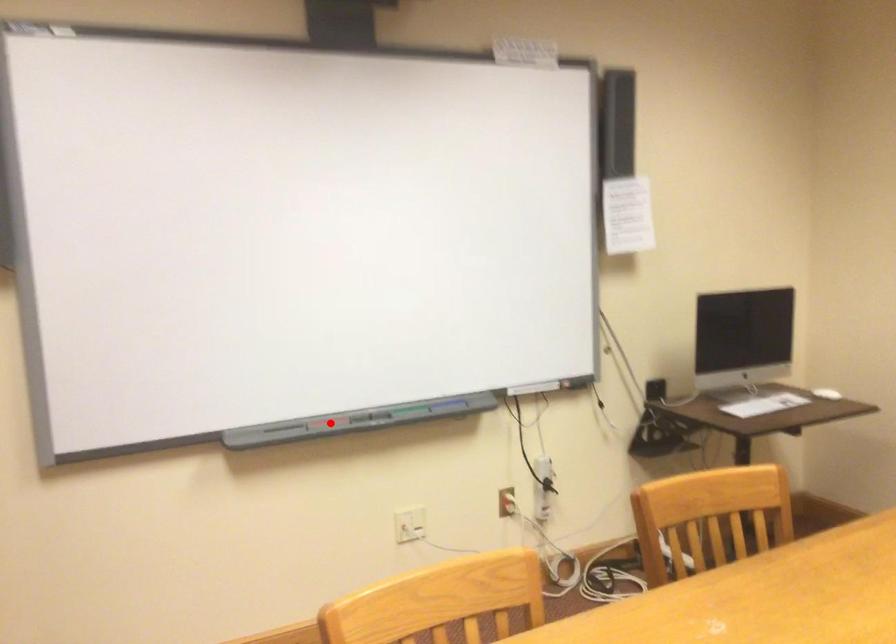
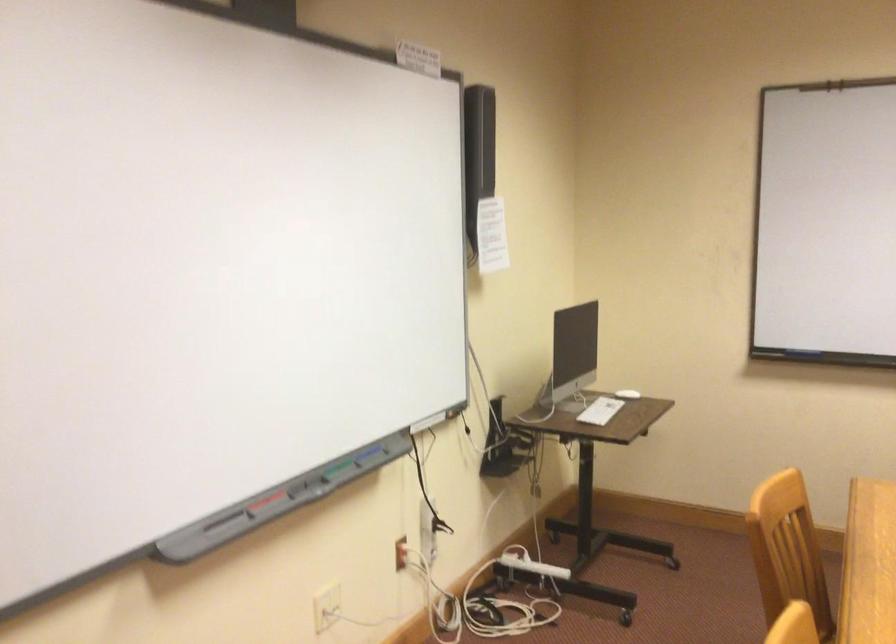
Where in the second image is the point corresponding to the highlighted location from the first image?

(264, 502)